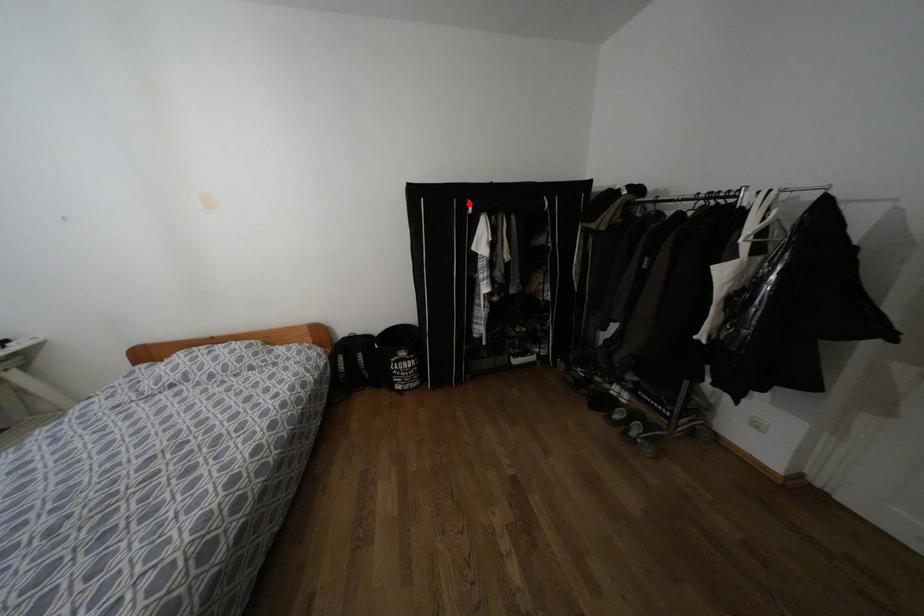
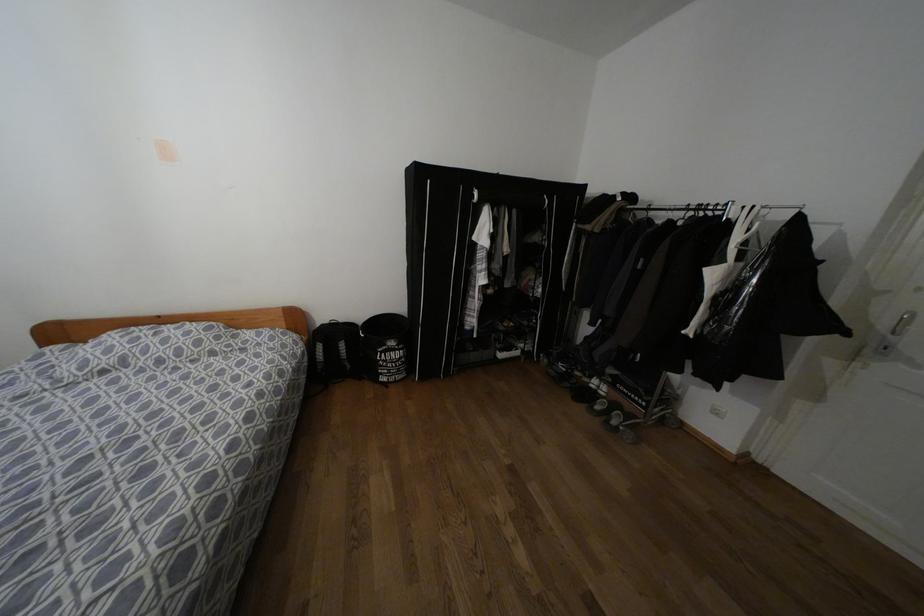
Question: I am providing you with two images of the same scene from different viewpoints. A red point is marked on the first image. At the location where the point appears in image 1, is it still visible in image 2?

Choices:
 (A) Yes
 (B) No

Answer: (A)